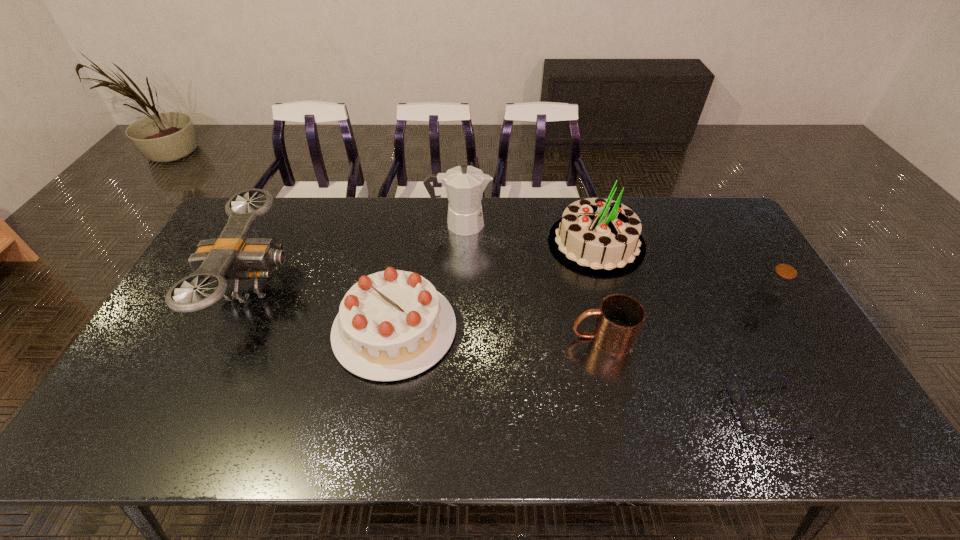
I want to click on free space located on the front-facing side of the spectacles, so click(x=694, y=410).

Locate an element on the screen. This screenshot has height=540, width=960. coffeepot at the far edge is located at coordinates (464, 184).

You are a GUI agent. You are given a task and a screenshot of the screen. Output one action in this format:
    pyautogui.click(x=<x>, y=<y>)
    Task: Click on the birthday cake that is at the far edge
    The width and height of the screenshot is (960, 540).
    Given the screenshot: What is the action you would take?
    pyautogui.click(x=599, y=237)

The width and height of the screenshot is (960, 540). Identify the location of drone located in the far edge section of the desktop. [x=233, y=255].

You are a GUI agent. You are given a task and a screenshot of the screen. Output one action in this format:
    pyautogui.click(x=<x>, y=<y>)
    Task: Click on the object that is positioned at the near edge
    
    Given the screenshot: What is the action you would take?
    pyautogui.click(x=748, y=419)

Find the location of `object that is at the left edge`. object that is at the left edge is located at coordinates (233, 255).

This screenshot has width=960, height=540. Find the location of `jar located in the right edge section of the desktop`. jar located in the right edge section of the desktop is located at coordinates (777, 284).

I want to click on spectacles that is at the right edge, so tap(748, 419).

Identify the location of object that is at the far left corner. The image size is (960, 540). (233, 255).

The image size is (960, 540). I want to click on object positioned at the near right corner, so (748, 419).